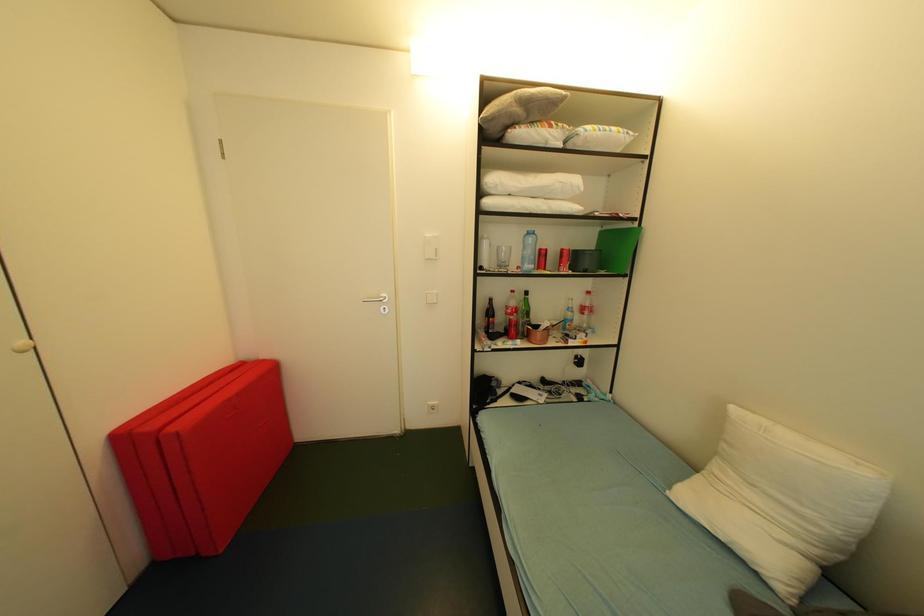
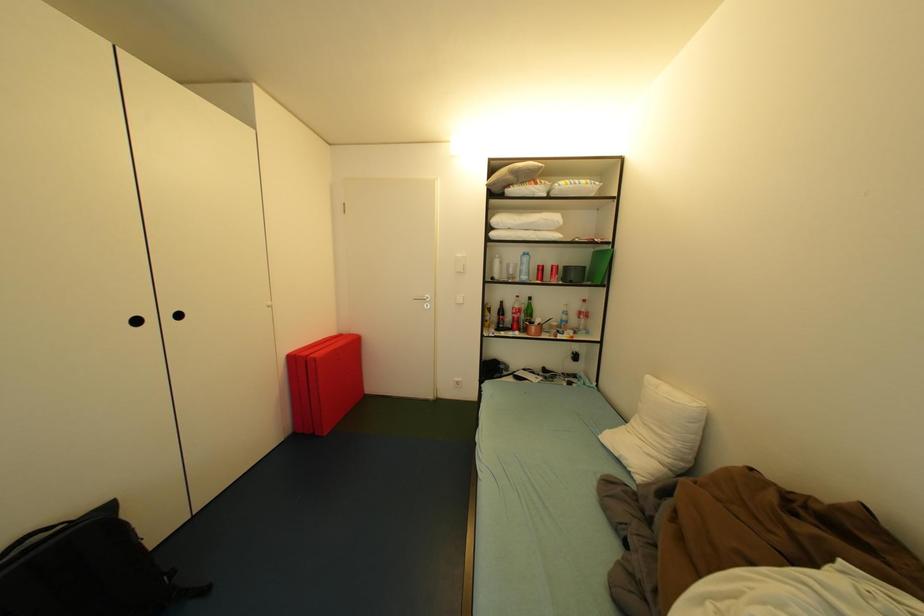
Which direction would the cameraman need to move to produce the second image?

The cameraman walked toward right, backward.